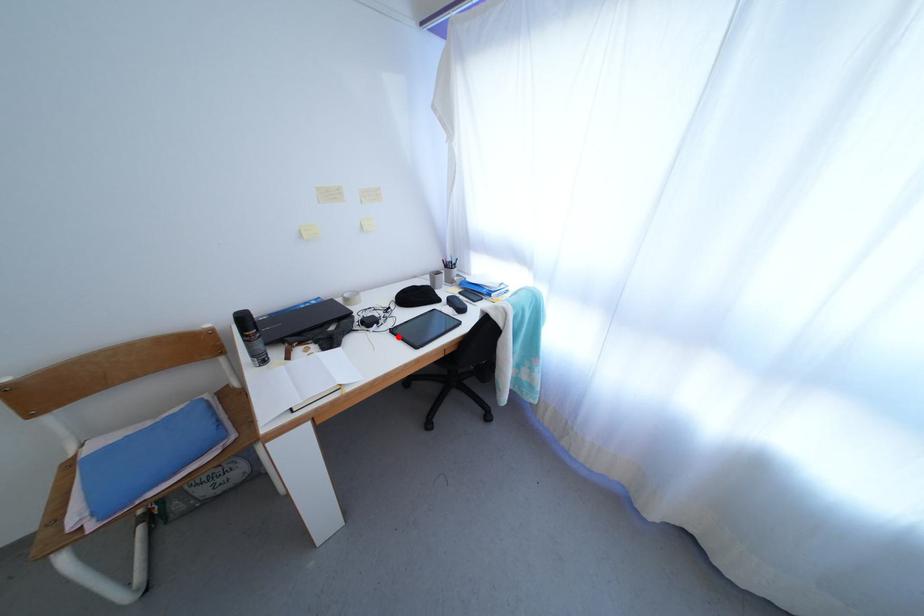
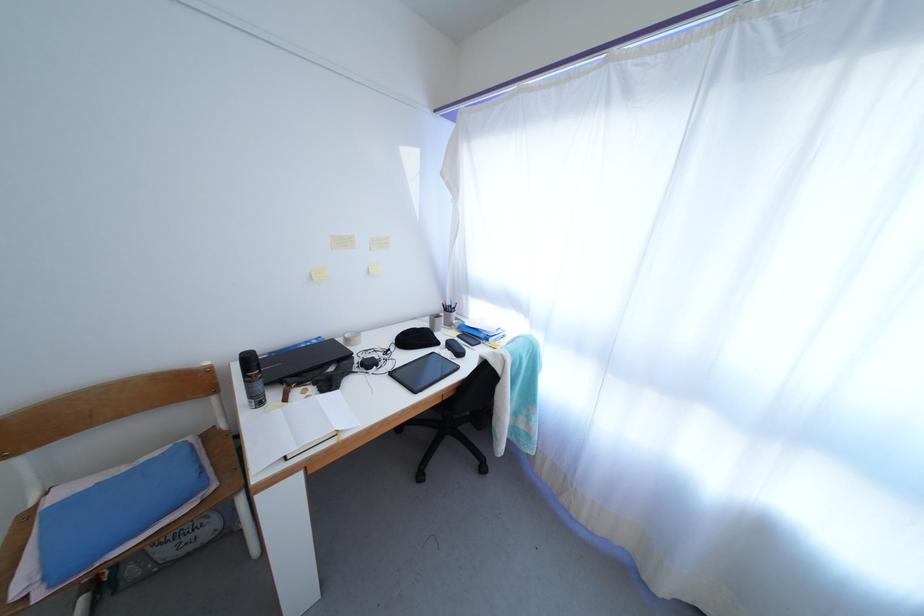
Locate, in the second image, the point that corresponds to the highlighted location in the first image.

(397, 379)